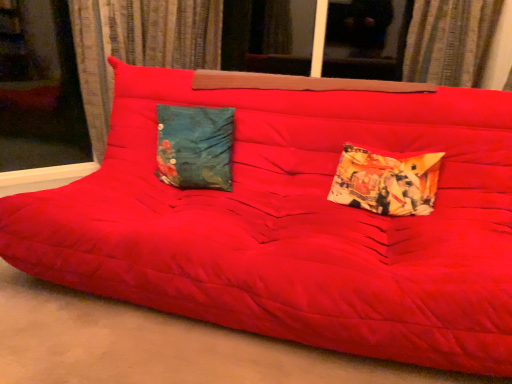
Question: Is transparent glass window at upper left, the 1th window when ordered from left to right, at the left side of transparent glass window at upper center, which is the 2th window in left-to-right order?

Choices:
 (A) no
 (B) yes

Answer: (B)

Question: Does transparent glass window at upper left, the 1th window when ordered from left to right, have a lesser height compared to transparent glass window at upper center, acting as the first window starting from the right?

Choices:
 (A) no
 (B) yes

Answer: (A)

Question: Is transparent glass window at upper center, acting as the first window starting from the right, located within transparent glass window at upper left, the 1th window when ordered from left to right?

Choices:
 (A) yes
 (B) no

Answer: (B)

Question: Considering the relative sizes of transparent glass window at upper left, which is the second window in right-to-left order, and transparent glass window at upper center, which is the 2th window in left-to-right order, in the image provided, is transparent glass window at upper left, which is the second window in right-to-left order, taller than transparent glass window at upper center, which is the 2th window in left-to-right order,?

Choices:
 (A) no
 (B) yes

Answer: (B)

Question: Is transparent glass window at upper left, the 1th window when ordered from left to right, further to camera compared to transparent glass window at upper center, which is the 2th window in left-to-right order?

Choices:
 (A) no
 (B) yes

Answer: (A)

Question: Is transparent glass window at upper left, which is the second window in right-to-left order, wider than transparent glass window at upper center, which is the 2th window in left-to-right order?

Choices:
 (A) yes
 (B) no

Answer: (B)

Question: Could you tell me if matte red futon at center is turned towards printed fabric pillow at right, positioned as the second pillow in left-to-right order?

Choices:
 (A) no
 (B) yes

Answer: (A)

Question: Is matte red futon at center completely or partially outside of printed fabric pillow at right, positioned as the 1th pillow in right-to-left order?

Choices:
 (A) yes
 (B) no

Answer: (A)

Question: Is matte red futon at center at the left side of printed fabric pillow at right, positioned as the 1th pillow in right-to-left order?

Choices:
 (A) yes
 (B) no

Answer: (A)

Question: Does matte red futon at center have a smaller size compared to printed fabric pillow at right, positioned as the 1th pillow in right-to-left order?

Choices:
 (A) yes
 (B) no

Answer: (B)

Question: Considering the relative positions of matte red futon at center and printed fabric pillow at right, positioned as the second pillow in left-to-right order, in the image provided, is matte red futon at center in front of printed fabric pillow at right, positioned as the second pillow in left-to-right order,?

Choices:
 (A) yes
 (B) no

Answer: (A)

Question: Is printed fabric pillow at right, positioned as the 1th pillow in right-to-left order, inside matte red futon at center?

Choices:
 (A) no
 (B) yes

Answer: (A)

Question: Does textured fabric curtain at upper center, which appears as the second curtain when viewed from the left, have a larger size compared to printed fabric pillow at right, positioned as the second pillow in left-to-right order?

Choices:
 (A) no
 (B) yes

Answer: (B)